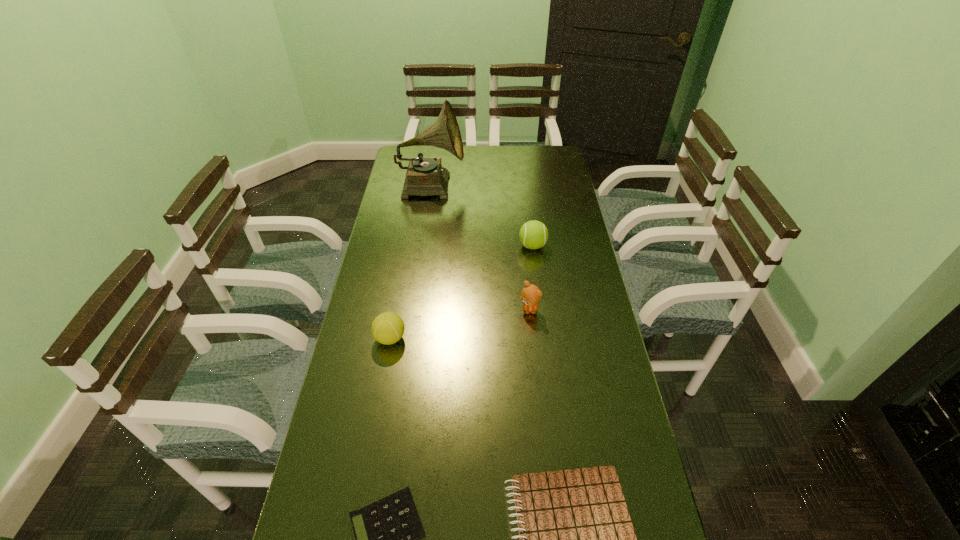
In the image, there is a desktop. Where is `free space at the far right corner`? This screenshot has height=540, width=960. free space at the far right corner is located at coordinates (548, 155).

At what (x,y) coordinates should I click in order to perform the action: click on free spot between the farther tennis ball and the nearer tennis ball. Please return your answer as a coordinate pair (x, y). This screenshot has height=540, width=960. Looking at the image, I should click on (462, 292).

Find the location of a particular element. free space between the nearer tennis ball and the record player is located at coordinates (411, 261).

This screenshot has height=540, width=960. In order to click on free spot between the second farthest object and the tallest object in this screenshot , I will do `click(482, 215)`.

Locate an element on the screen. The width and height of the screenshot is (960, 540). empty space between the farthest object and the third farthest object is located at coordinates (480, 247).

Locate which object is the fourth closest to the shortest object. Please provide its 2D coordinates. Your answer should be formatted as a tuple, i.e. [(x, y)], where the tuple contains the x and y coordinates of a point satisfying the conditions above.

[(533, 234)]

You are a GUI agent. You are given a task and a screenshot of the screen. Output one action in this format:
    pyautogui.click(x=<x>, y=<y>)
    Task: Click on the second closest object to the tallest object
    This screenshot has height=540, width=960.
    Given the screenshot: What is the action you would take?
    pyautogui.click(x=531, y=294)

I want to click on free space that satisfies the following two spatial constraints: 1. from the horn of the farthest object; 2. on the right side of the right tennis ball, so click(422, 246).

At what (x,y) coordinates should I click in order to perform the action: click on free space that satisfies the following two spatial constraints: 1. from the horn of the farthest object; 2. on the right side of the farther tennis ball. Please return your answer as a coordinate pair (x, y). The width and height of the screenshot is (960, 540). Looking at the image, I should click on (422, 246).